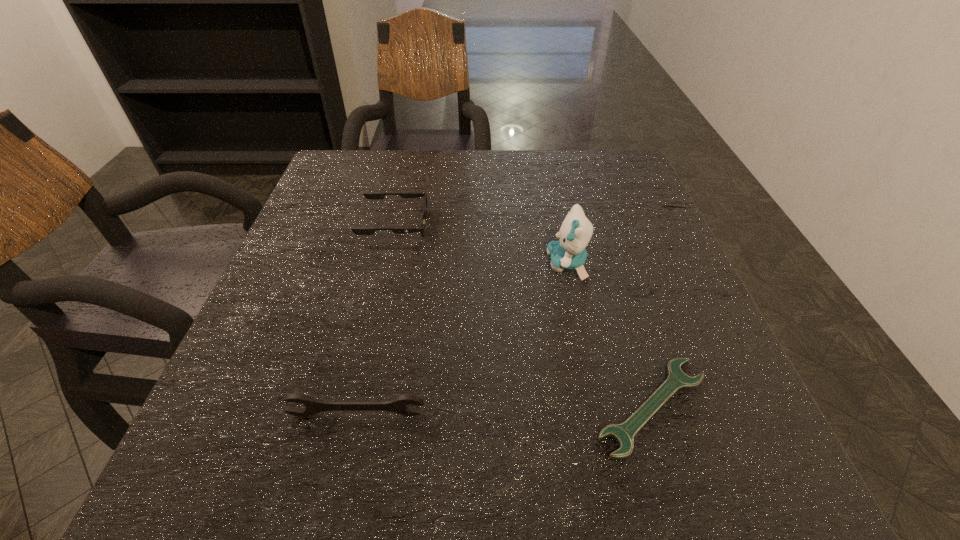
Where is `vacant area between the third shortest object and the farthest object`? vacant area between the third shortest object and the farthest object is located at coordinates (375, 320).

Identify the location of vacant space that's between the shortest object and the kitten. (610, 335).

You are a GUI agent. You are given a task and a screenshot of the screen. Output one action in this format:
    pyautogui.click(x=<x>, y=<y>)
    Task: Click on the vacant area between the second shortest object and the shortest object
    The image size is (960, 540).
    Given the screenshot: What is the action you would take?
    pyautogui.click(x=523, y=315)

Locate which object ranks third in proximity to the farthest object. Please provide its 2D coordinates. Your answer should be formatted as a tuple, i.e. [(x, y)], where the tuple contains the x and y coordinates of a point satisfying the conditions above.

[(624, 433)]

Locate which object ranks second in proximity to the third shortest object. Please provide its 2D coordinates. Your answer should be formatted as a tuple, i.e. [(x, y)], where the tuple contains the x and y coordinates of a point satisfying the conditions above.

[(568, 253)]

Where is `free spot that satisfies the following two spatial constraints: 1. on the face of the shorter wrench; 2. on the right side of the second farthest object`? free spot that satisfies the following two spatial constraints: 1. on the face of the shorter wrench; 2. on the right side of the second farthest object is located at coordinates (596, 406).

Image resolution: width=960 pixels, height=540 pixels. I want to click on vacant point that satisfies the following two spatial constraints: 1. on the temples of the right wrench; 2. on the left side of the farthest object, so click(x=353, y=406).

At what (x,y) coordinates should I click in order to perform the action: click on vacant region that satisfies the following two spatial constraints: 1. on the back side of the shortest object; 2. on the face of the second farthest object. Please return your answer as a coordinate pair (x, y). Looking at the image, I should click on (608, 264).

Find the location of `free space that satisfies the following two spatial constraints: 1. on the face of the tallest object; 2. on the open ends of the taller wrench`. free space that satisfies the following two spatial constraints: 1. on the face of the tallest object; 2. on the open ends of the taller wrench is located at coordinates (598, 414).

The image size is (960, 540). In order to click on blank area in the image that satisfies the following two spatial constraints: 1. on the temples of the second shortest object; 2. on the back side of the shorter wrench in this screenshot , I will do `click(353, 406)`.